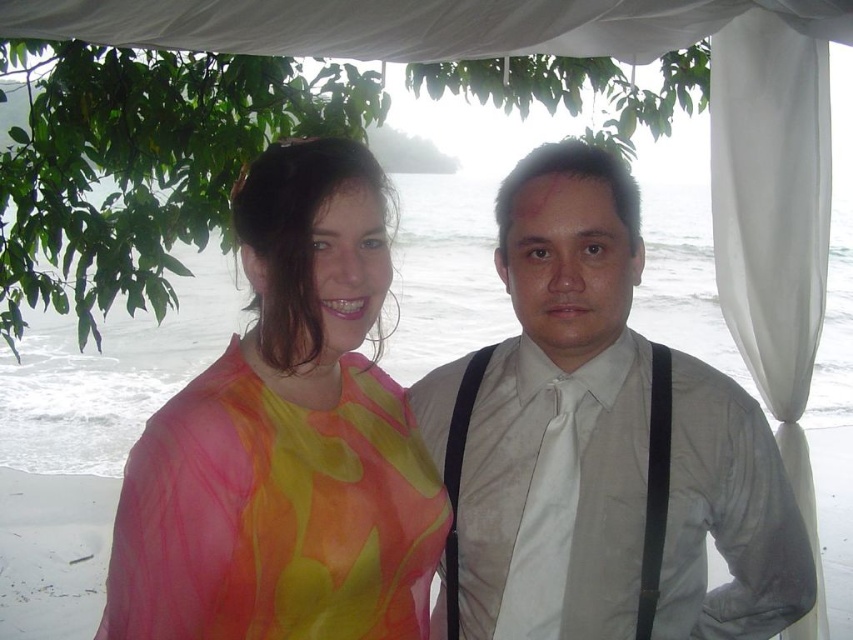
At what (x,y) coordinates should I click in order to perform the action: click on translucent floral blouse at center. Please return your answer as a coordinate pair (x, y). This screenshot has width=853, height=640. Looking at the image, I should click on (286, 440).

Which is in front, point (384, 195) or point (764, 116)?

Point (384, 195) is in front.

Does point (381, 209) lie behind point (712, 51)?

No, (381, 209) is closer to viewer.

The image size is (853, 640). I want to click on translucent floral blouse at center, so click(286, 440).

Can you confirm if green leafy tree at upper left is positioned below white satin tie at center?

No.

Can you confirm if green leafy tree at upper left is positioned to the right of white satin tie at center?

Incorrect, green leafy tree at upper left is not on the right side of white satin tie at center.

What are the coordinates of `green leafy tree at upper left` in the screenshot? It's located at (142, 164).

Is point (306, 596) closer to camera compared to point (30, 241)?

Yes, it is.

Does translucent floral blouse at center have a lesser width compared to green leafy tree at upper left?

Yes, translucent floral blouse at center is thinner than green leafy tree at upper left.

The width and height of the screenshot is (853, 640). In order to click on translucent floral blouse at center in this screenshot , I will do `click(286, 440)`.